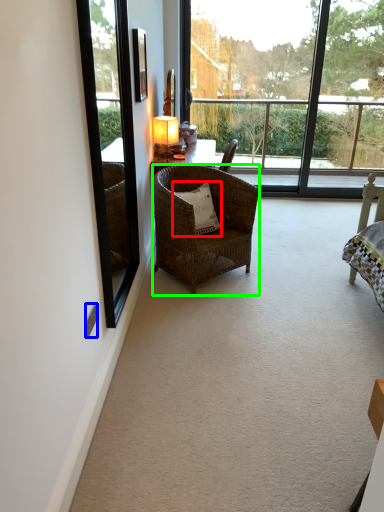
Question: Which is nearer to the pillow (highlighted by a red box)? power outlet (highlighted by a blue box) or chair (highlighted by a green box).

Choices:
 (A) power outlet
 (B) chair

Answer: (B)